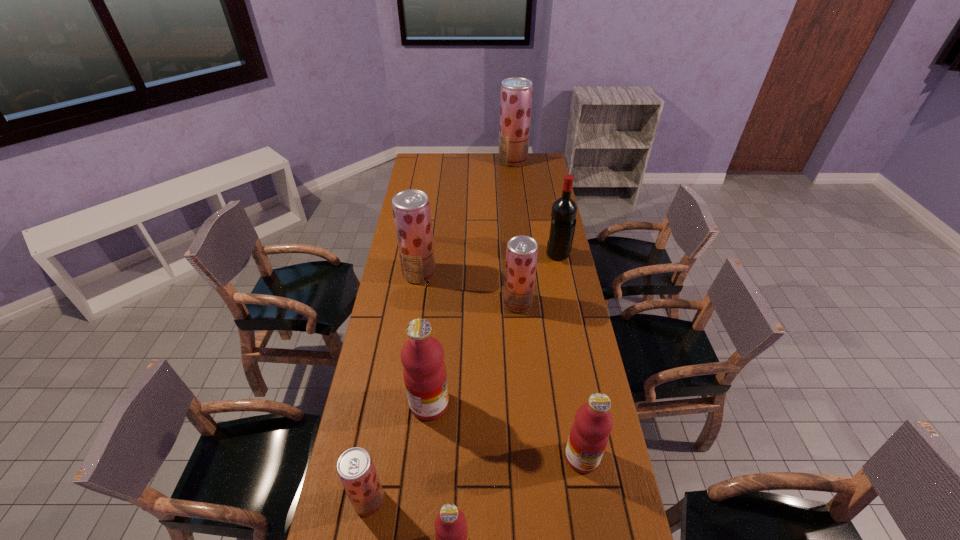
Choose which pink fruit juice is the second nearest neighbor to the biggest strawberry fruit juice. Please provide its 2D coordinates. Your answer should be formatted as a tuple, i.e. [(x, y)], where the tuple contains the x and y coordinates of a point satisfying the conditions above.

[(589, 435)]

You are a GUI agent. You are given a task and a screenshot of the screen. Output one action in this format:
    pyautogui.click(x=<x>, y=<y>)
    Task: Click on the vacant space that satisfies the following two spatial constraints: 1. on the back side of the sixth farthest fruit juice; 2. on the left side of the fifth nearest object
    The height and width of the screenshot is (540, 960).
    Given the screenshot: What is the action you would take?
    pyautogui.click(x=403, y=303)